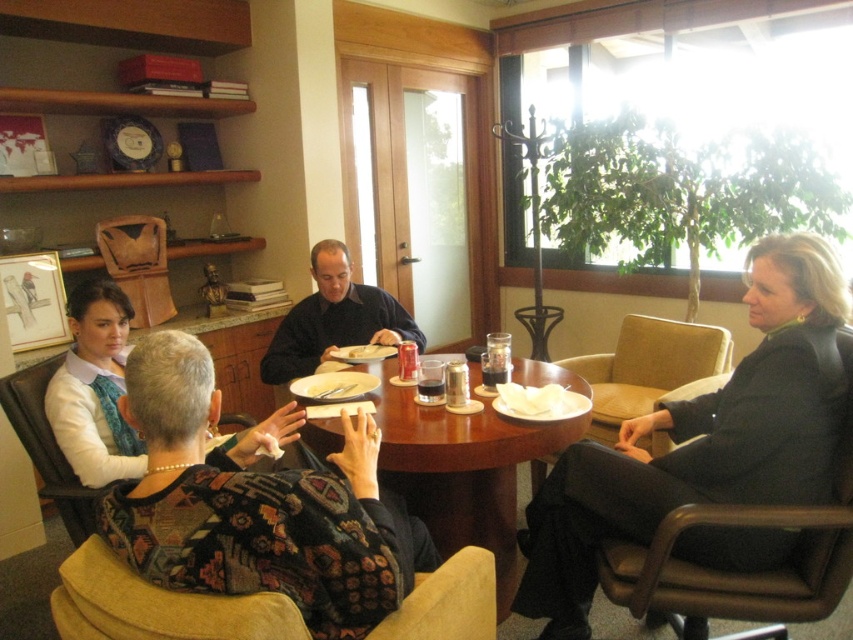
You are a server in a restaurant and need to place a new order of drinks on the table. The table already has a floral sweater at center and a translucent plastic cup at center. Which object should you avoid placing drinks next to to prevent spills?

You should avoid placing drinks next to the floral sweater at center because it is larger in size than the translucent plastic cup at center and might take up more space, increasing the risk of spills.